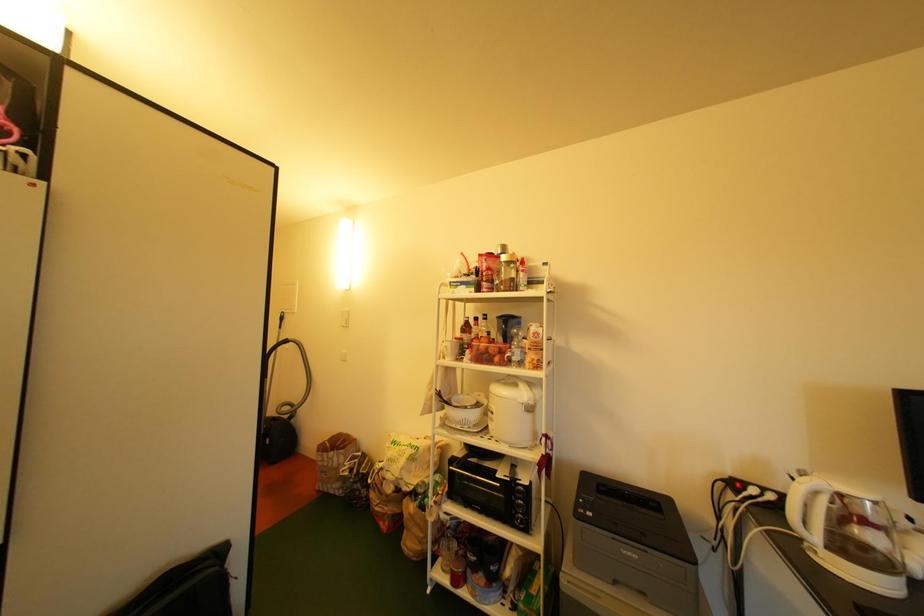
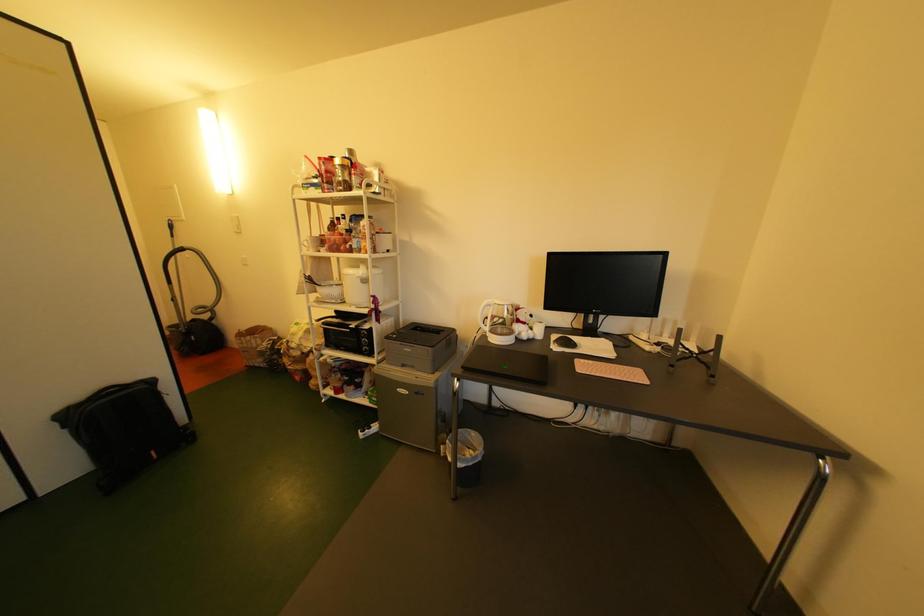
Question: How did the camera likely rotate?

Choices:
 (A) Left
 (B) Right
 (C) Up
 (D) Down

Answer: (D)